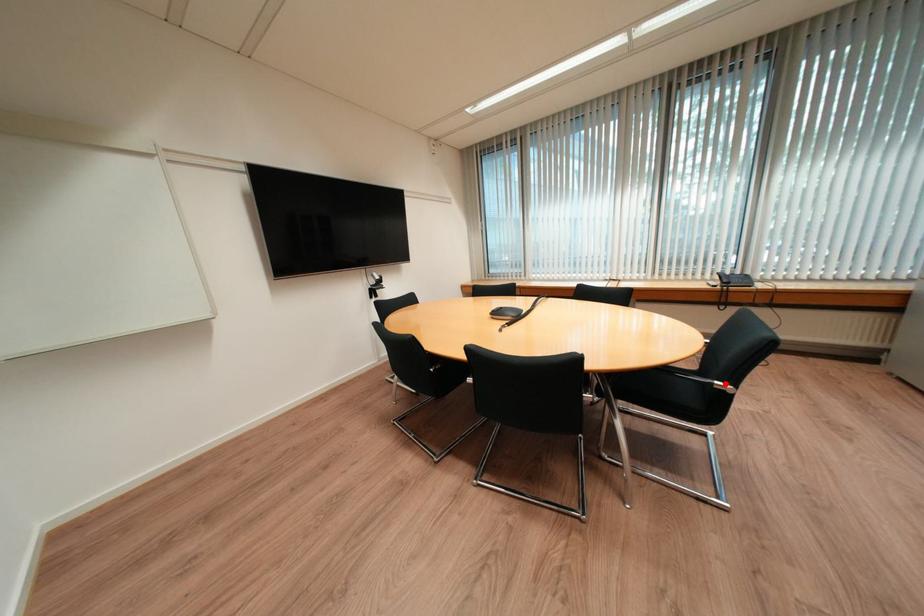
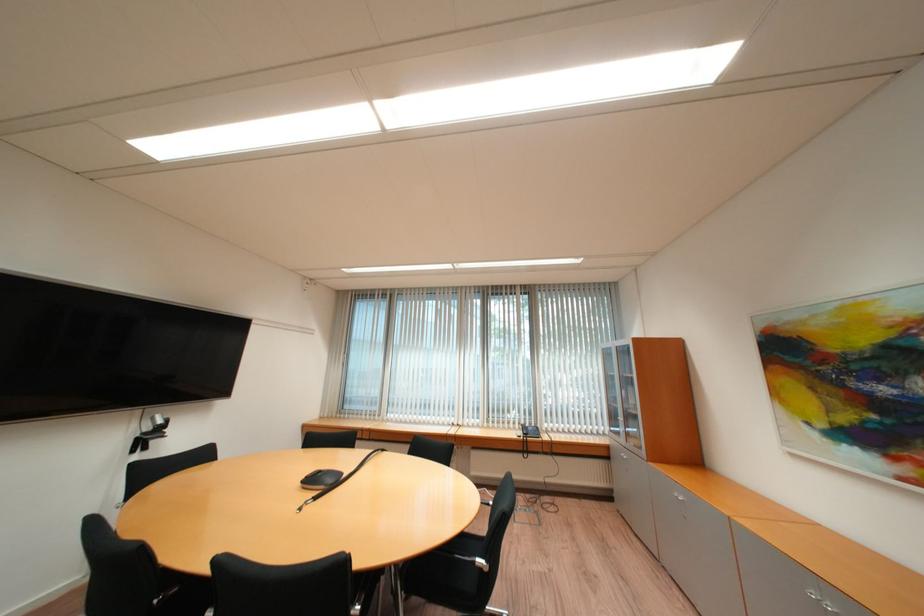
In the second image, find the point that corresponds to the highlighted location in the first image.

(487, 561)